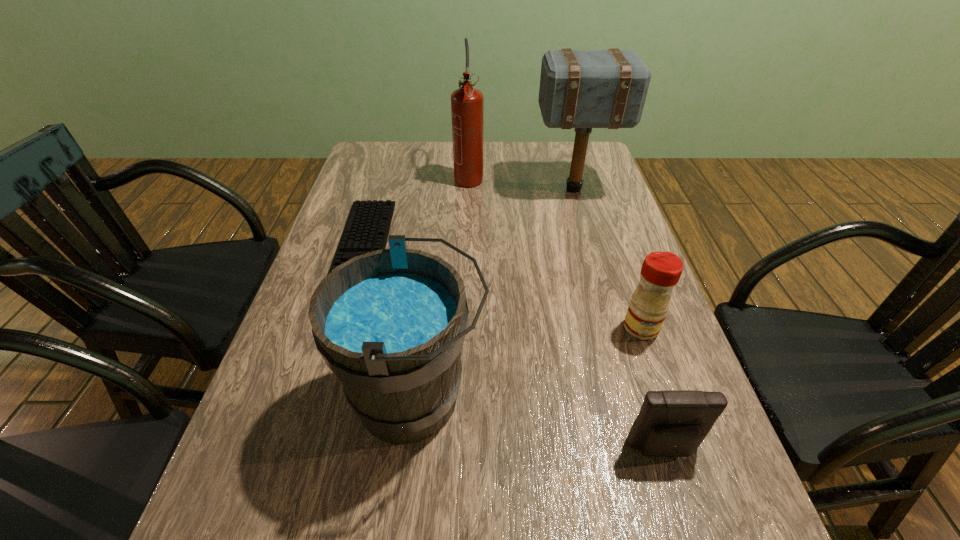
This screenshot has width=960, height=540. Find the location of `condiment that is at the right edge`. condiment that is at the right edge is located at coordinates click(x=661, y=271).

Locate an element on the screen. Image resolution: width=960 pixels, height=540 pixels. pouch that is at the right edge is located at coordinates (671, 423).

You are a GUI agent. You are given a task and a screenshot of the screen. Output one action in this format:
    pyautogui.click(x=<x>, y=<y>)
    Task: Click on the object at the far right corner
    The width and height of the screenshot is (960, 540).
    Given the screenshot: What is the action you would take?
    pyautogui.click(x=583, y=89)

Where is `vacant area at the far edge of the desktop`? vacant area at the far edge of the desktop is located at coordinates (413, 175).

Image resolution: width=960 pixels, height=540 pixels. I want to click on blank space at the right edge, so click(591, 207).

In order to click on vacant space at the far left corner in this screenshot , I will do `click(374, 171)`.

Image resolution: width=960 pixels, height=540 pixels. In order to click on unoccupied position between the fourth shortest object and the fifth tallest object in this screenshot , I will do `click(540, 423)`.

Locate an element on the screen. Image resolution: width=960 pixels, height=540 pixels. empty location between the mallet and the fire extinguisher is located at coordinates (521, 183).

The height and width of the screenshot is (540, 960). What are the coordinates of `empty location between the fire extinguisher and the shortest object` in the screenshot? It's located at (417, 210).

Where is `free space between the wine bucket and the mallet`? The height and width of the screenshot is (540, 960). free space between the wine bucket and the mallet is located at coordinates (495, 293).